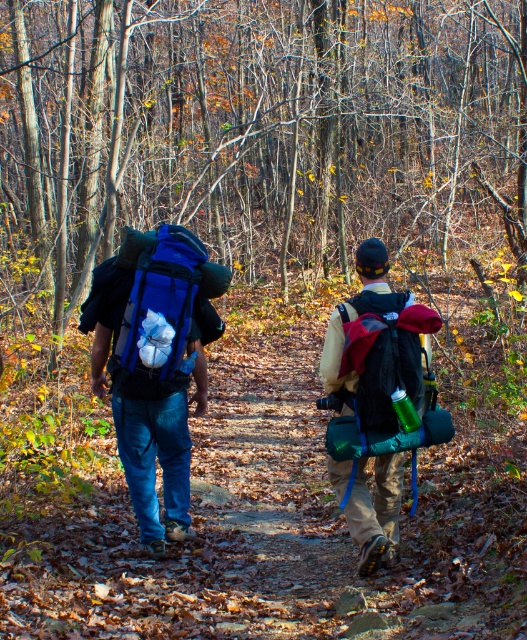
You are a hiker trying to decide which backpack to take for your trip. You notice the matte blue backpack at center and the matte black backpack at center in the image. Based on their positions in the image, which backpack is positioned lower?

The matte blue backpack at center is positioned lower than the matte black backpack at center according to the image.

You are a hiker trying to locate your friend who is carrying a matte blue backpack at center. You are standing at the origin point of the coordinate system. Which direction should you move to find your friend?

You should move towards the coordinates point (378, 401) to find your friend with the matte blue backpack at center.